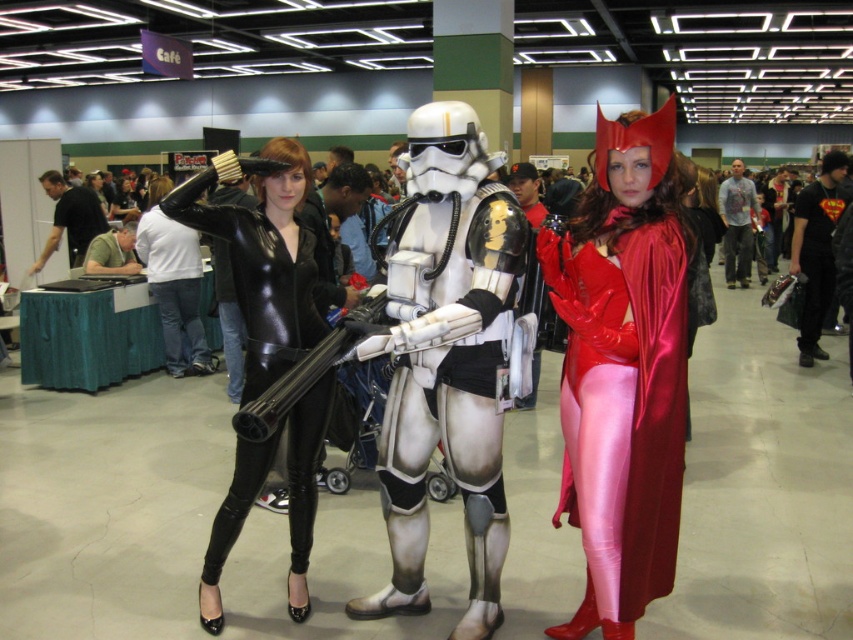
Is shiny red cape at center thinner than black shiny suit at center?

Correct, shiny red cape at center's width is less than black shiny suit at center's.

Between shiny red cape at center and black shiny suit at center, which one has more height?

shiny red cape at center is taller.

Between point (633, 333) and point (311, 410), which one is positioned behind?

Positioned behind is point (311, 410).

This screenshot has height=640, width=853. I want to click on shiny red cape at center, so click(x=624, y=369).

Does white metallic armor at center lie in front of black shiny suit at center?

Yes, it is in front of black shiny suit at center.

I want to click on white metallic armor at center, so click(x=445, y=358).

Where is `white metallic armor at center`? white metallic armor at center is located at coordinates (x=445, y=358).

Can you confirm if shiny red cape at center is taller than white metallic armor at center?

In fact, shiny red cape at center may be shorter than white metallic armor at center.

Is shiny red cape at center further to camera compared to white metallic armor at center?

No, shiny red cape at center is closer to the viewer.

Locate an element on the screen. shiny red cape at center is located at coordinates (624, 369).